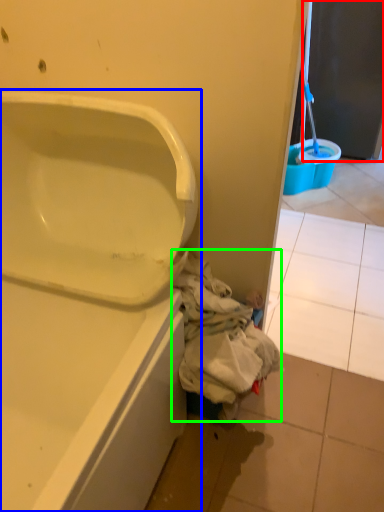
Question: Considering the real-world distances, which object is farthest from screen door (highlighted by a red box)? bathtub (highlighted by a blue box) or garbage (highlighted by a green box)?

Choices:
 (A) bathtub
 (B) garbage

Answer: (A)